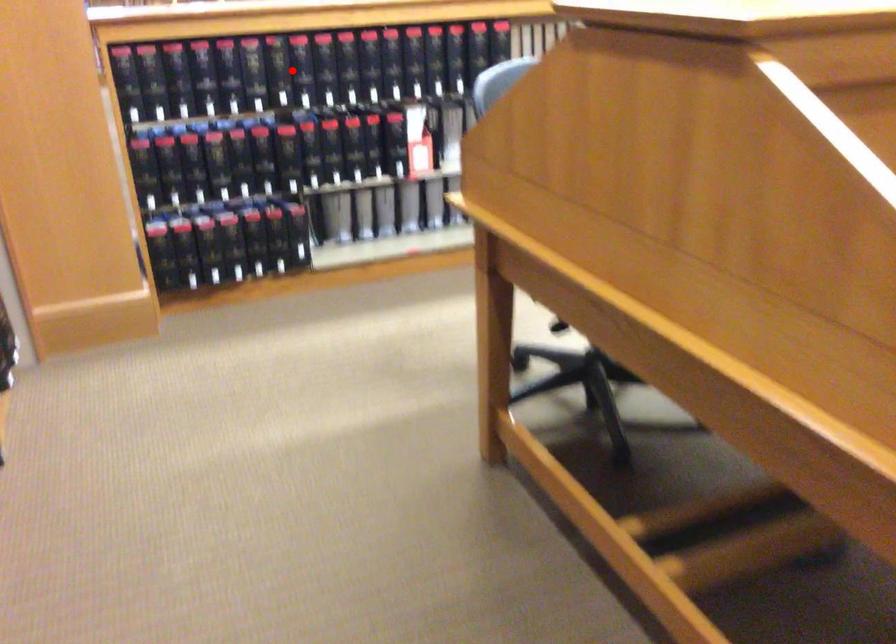
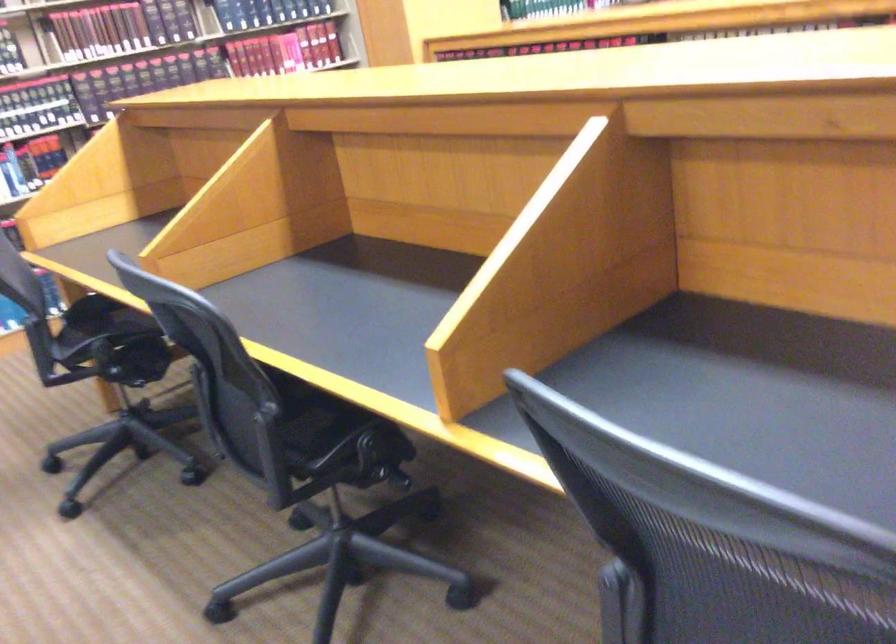
Question: I am providing you with two images of the same scene from different viewpoints. A red point is marked on the first image. Can you still see the location of the red point in image 2?

Choices:
 (A) Yes
 (B) No

Answer: (B)